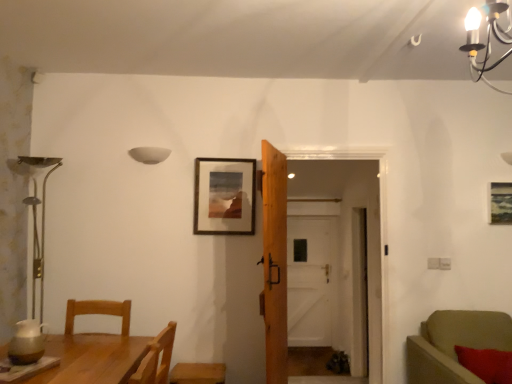
Question: Which is correct: wooden picture frame at center, arranged as the 1th picture frame when viewed from the left, is inside velvet green sofa at right, or outside of it?

Choices:
 (A) inside
 (B) outside

Answer: (B)

Question: Does point (245, 203) appear closer or farther from the camera than point (436, 314)?

Choices:
 (A) farther
 (B) closer

Answer: (A)

Question: Which is nearer to the white matte bowl at upper center?

Choices:
 (A) red fuzzy pillow at lower right
 (B) wooden door at center, the second door positioned from the back
 (C) wooden picture frame at upper right, positioned as the 1th picture frame in right-to-left order
 (D) wooden picture frame at center, arranged as the 1th picture frame when viewed from the left
 (E) wooden table at lower left

Answer: (D)

Question: Estimate the real-world distances between objects in this image. Which object is closer to the wooden armchair at lower center?

Choices:
 (A) white wooden door at center, acting as the 2th door starting from the left
 (B) white matte bowl at upper center
 (C) wooden table at lower left
 (D) wooden door at center, positioned as the second door in right-to-left order
 (E) red fuzzy pillow at lower right

Answer: (D)